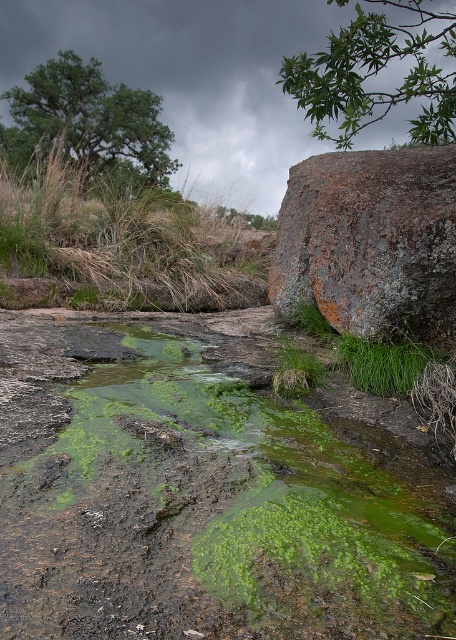
Question: Which object is closer to the camera taking this photo?

Choices:
 (A) rusty rock at upper right
 (B) green mossy rock at center
 (C) green mossy algae at upper left

Answer: (B)

Question: Which of these objects is positioned farthest from the rusty rock at upper right?

Choices:
 (A) green mossy algae at upper left
 (B) green mossy rock at center

Answer: (A)

Question: Does green mossy rock at center have a lesser width compared to rusty rock at upper right?

Choices:
 (A) no
 (B) yes

Answer: (A)

Question: Observing the image, what is the correct spatial positioning of green mossy rock at center in reference to rusty rock at upper right?

Choices:
 (A) left
 (B) right

Answer: (A)

Question: Estimate the real-world distances between objects in this image. Which object is farther from the green mossy rock at center?

Choices:
 (A) rusty rock at upper right
 (B) green mossy algae at upper left

Answer: (B)

Question: Observing the image, what is the correct spatial positioning of green mossy rock at center in reference to rusty rock at upper right?

Choices:
 (A) below
 (B) above

Answer: (A)